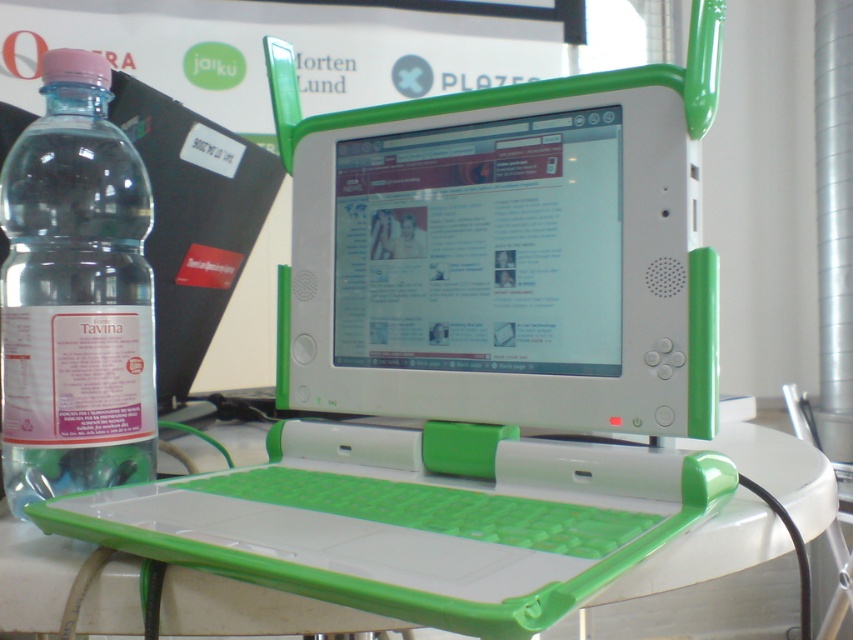
You are sitting at a desk and want to reach for the green plastic computer monitor at center and the white plastic table at center. Which object is closer to you?

The green plastic computer monitor at center is closer to you because it is positioned further to the viewer than the white plastic table at center.

You are setting up a desk for a student. You have a green plastic computer monitor at center and a white plastic table at center. Which object is taller?

The green plastic computer monitor at center is much taller than the white plastic table at center.

You are standing in front of the table with the small green and white laptop. There is a point marked at coordinates (74, 294). What object is located at that point?

The point at coordinates (74, 294) indicates the clear plastic bottle at left.